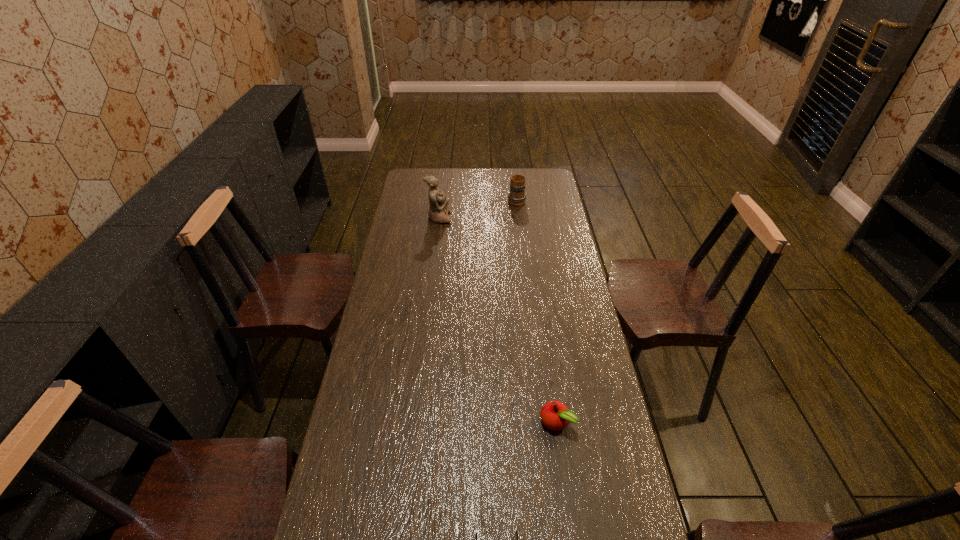
Locate an element on the screen. vacant area situated 0.230m on the left of the third tallest object is located at coordinates (460, 422).

Where is `object positioned at the left edge`? object positioned at the left edge is located at coordinates (438, 203).

You are a GUI agent. You are given a task and a screenshot of the screen. Output one action in this format:
    pyautogui.click(x=<x>, y=<y>)
    Task: Click on the object present at the right edge
    This screenshot has height=540, width=960.
    Given the screenshot: What is the action you would take?
    pyautogui.click(x=555, y=415)

At what (x,y) coordinates should I click in order to perform the action: click on vacant space at the left edge of the desktop. Please return your answer as a coordinate pair (x, y). Image resolution: width=960 pixels, height=540 pixels. Looking at the image, I should click on (396, 221).

Identify the location of free space at the right edge of the desktop. The image size is (960, 540). (560, 197).

The height and width of the screenshot is (540, 960). What are the coordinates of `unoccupied position between the mug and the figurine` in the screenshot? It's located at (478, 209).

Find the location of a particular element. empty space between the mug and the third tallest object is located at coordinates (537, 310).

Find the location of `vacant space that's between the second nearest object and the second farthest object`. vacant space that's between the second nearest object and the second farthest object is located at coordinates (497, 320).

The width and height of the screenshot is (960, 540). In order to click on vacant point located between the third tallest object and the farthest object in this screenshot , I will do `click(537, 310)`.

Locate an element on the screen. This screenshot has height=540, width=960. vacant area that lies between the tallest object and the third shortest object is located at coordinates (478, 209).